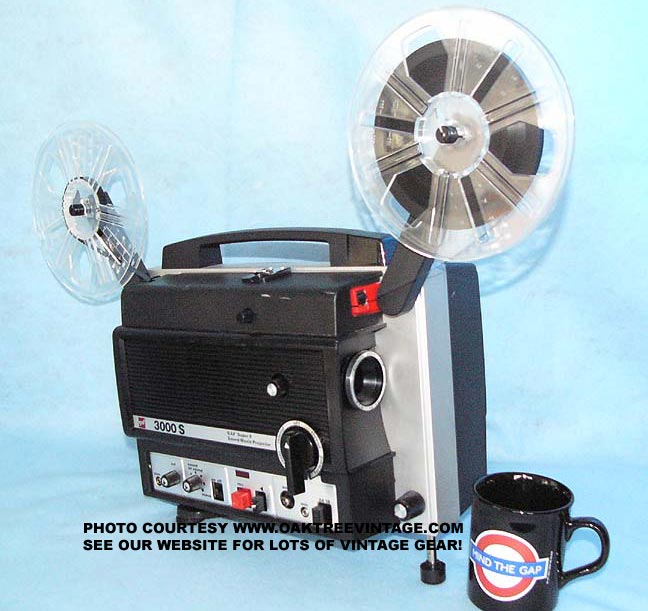
Where is `knobs`? Image resolution: width=648 pixels, height=611 pixels. knobs is located at coordinates (165, 476), (191, 481), (295, 454), (402, 505), (269, 386), (245, 312).